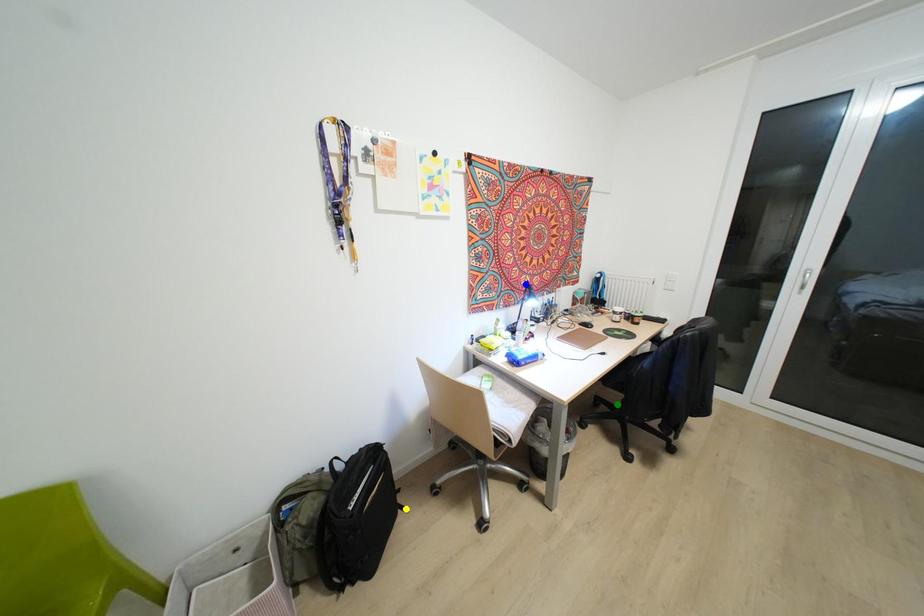
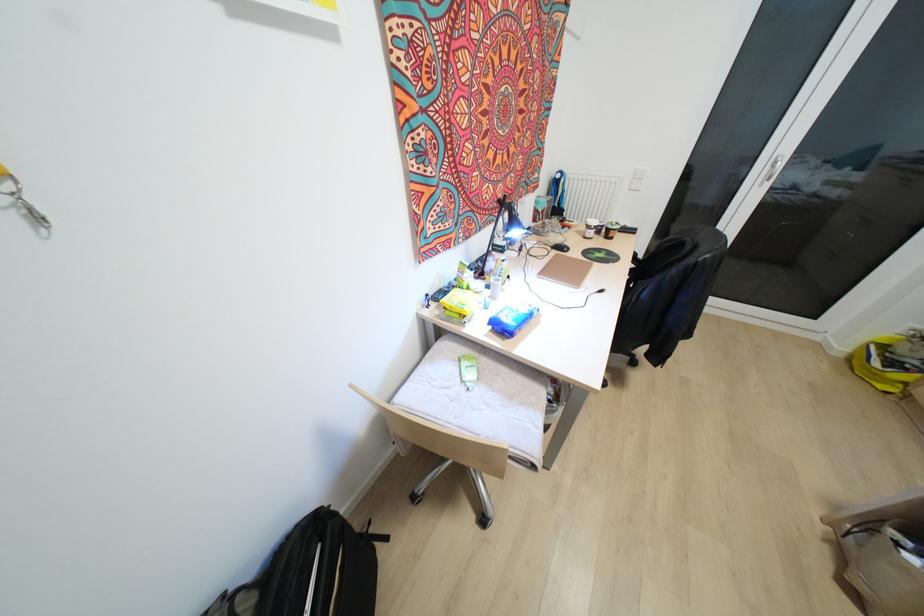
I am providing you with two images of the same scene from different viewpoints. Three points are marked in image1. Which point corresponds to a part or object that is occluded in image2?In image1, three points are marked. Which of them correspond to a part or object that is occluded in image2?Among the three points shown in image1, which one corresponds to a part or object that is no longer visible due to occlusion in image2?

Invisible in image2: green point.